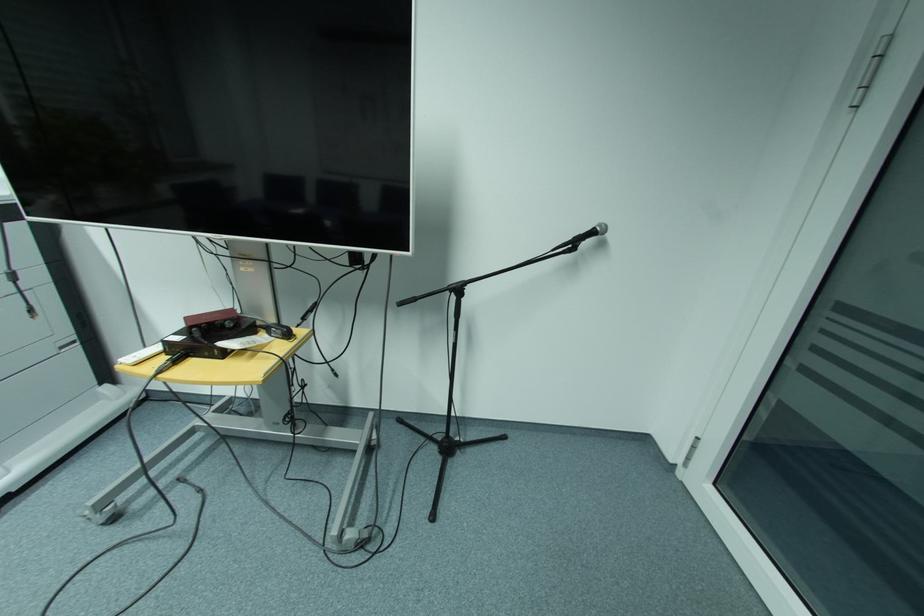
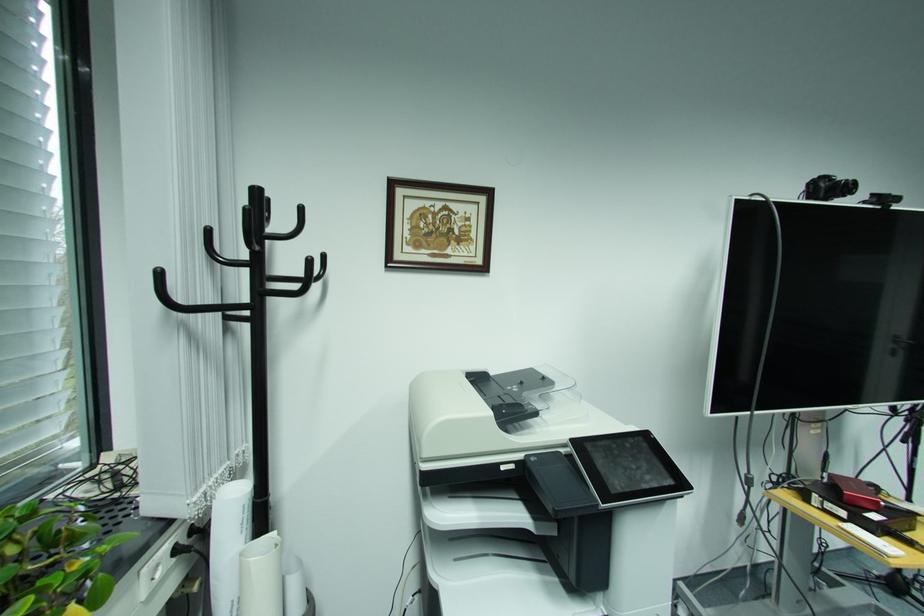
Question: Which direction would the cameraman need to move to produce the second image? Reply with the corresponding letter.

Choices:
 (A) Left
 (B) Right
 (C) Forward
 (D) Backward

Answer: (A)